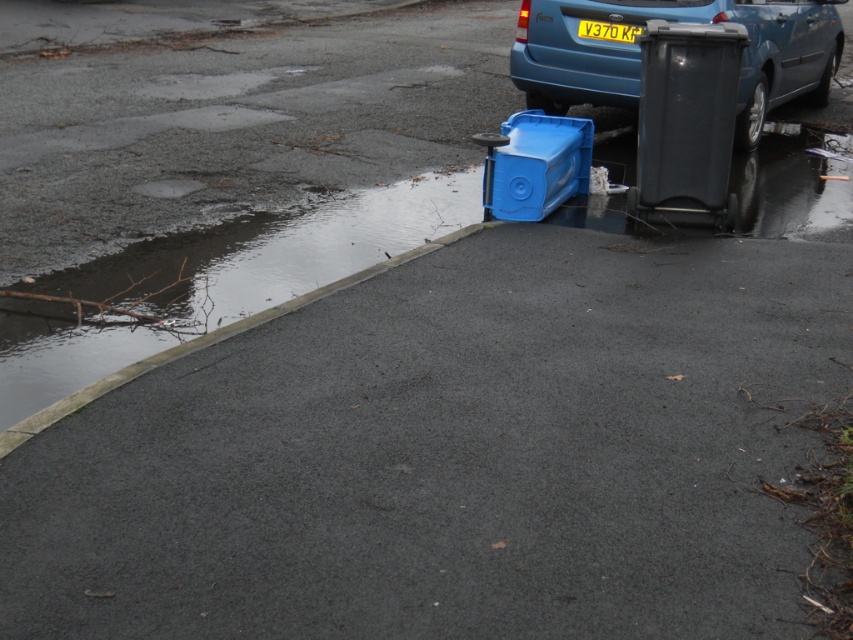
Question: Where is black plastic trash can at right located in relation to yellow matte license plate at upper center in the image?

Choices:
 (A) above
 (B) below

Answer: (B)

Question: Estimate the real-world distances between objects in this image. Which object is farther from the blue plastic cooler at lower right?

Choices:
 (A) matte blue car at upper right
 (B) black plastic trash can at right
 (C) yellow matte license plate at upper center

Answer: (A)

Question: Which object is farther from the camera taking this photo?

Choices:
 (A) blue plastic cooler at lower right
 (B) yellow matte license plate at upper center
 (C) matte blue car at upper right
 (D) black plastic trash can at right

Answer: (B)

Question: Is black plastic trash can at right positioned before yellow matte license plate at upper center?

Choices:
 (A) no
 (B) yes

Answer: (B)

Question: Does matte blue car at upper right have a lesser width compared to yellow matte license plate at upper center?

Choices:
 (A) no
 (B) yes

Answer: (A)

Question: Which object is positioned closest to the black plastic trash can at right?

Choices:
 (A) matte blue car at upper right
 (B) yellow matte license plate at upper center

Answer: (B)